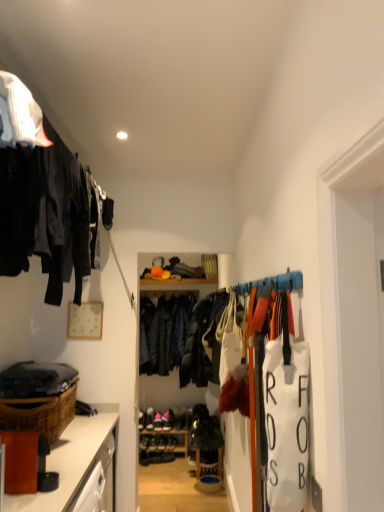
The width and height of the screenshot is (384, 512). I want to click on matte black clothing at upper left, so click(x=45, y=197).

This screenshot has width=384, height=512. I want to click on dark blue leather jacket at center, so click(164, 332).

Image resolution: width=384 pixels, height=512 pixels. What do you see at coordinates (163, 443) in the screenshot? I see `wooden shelf at center` at bounding box center [163, 443].

Find the location of a particular element. Image resolution: width=384 pixels, height=512 pixels. matte black clothing at upper left is located at coordinates (45, 197).

Considering the sizes of objects brown wood cabinet at lower left and matte black clothing at upper left in the image provided, who is taller, brown wood cabinet at lower left or matte black clothing at upper left?

With more height is matte black clothing at upper left.

Is brown wood cabinet at lower left at the right side of matte black clothing at upper left?

No.

Considering the relative sizes of brown wood cabinet at lower left and matte black clothing at upper left in the image provided, is brown wood cabinet at lower left thinner than matte black clothing at upper left?

Incorrect, the width of brown wood cabinet at lower left is not less than that of matte black clothing at upper left.

From the picture: Considering the relative sizes of brown wood cabinet at lower left and dark blue leather jacket at center in the image provided, is brown wood cabinet at lower left bigger than dark blue leather jacket at center?

Yes.

Which of these two, brown wood cabinet at lower left or dark blue leather jacket at center, is wider?

brown wood cabinet at lower left is wider.

Is brown wood cabinet at lower left situated inside dark blue leather jacket at center or outside?

The correct answer is: outside.

From the picture: Who is shorter, brown wood cabinet at lower left or dark blue leather jacket at center?

With less height is brown wood cabinet at lower left.

Considering the sizes of brown woven basket at lower left and dark blue leather jacket at center in the image, is brown woven basket at lower left wider or thinner than dark blue leather jacket at center?

In the image, brown woven basket at lower left appears to be wider than dark blue leather jacket at center.

Considering the sizes of objects brown woven basket at lower left and dark blue leather jacket at center in the image provided, who is shorter, brown woven basket at lower left or dark blue leather jacket at center?

Standing shorter between the two is brown woven basket at lower left.

Is brown woven basket at lower left completely or partially outside of dark blue leather jacket at center?

Yes.

Is brown woven basket at lower left facing towards dark blue leather jacket at center?

No, brown woven basket at lower left is not aimed at dark blue leather jacket at center.

Considering the sizes of objects brown woven basket at lower left and brown wood cabinet at lower left in the image provided, who is bigger, brown woven basket at lower left or brown wood cabinet at lower left?

brown wood cabinet at lower left is bigger.

Is brown woven basket at lower left not close to brown wood cabinet at lower left?

They are positioned close to each other.

Does brown woven basket at lower left have a lesser height compared to brown wood cabinet at lower left?

Indeed, brown woven basket at lower left has a lesser height compared to brown wood cabinet at lower left.

Considering the positions of objects brown woven basket at lower left and brown wood cabinet at lower left in the image provided, who is more to the right, brown woven basket at lower left or brown wood cabinet at lower left?

brown wood cabinet at lower left.

Is pink suede shoes at center situated inside wooden shelf at center or outside?

pink suede shoes at center exists outside the volume of wooden shelf at center.

From the image's perspective, relative to wooden shelf at center, is pink suede shoes at center above or below?

Based on their image positions, pink suede shoes at center is located above wooden shelf at center.

Is pink suede shoes at center beside wooden shelf at center?

No, pink suede shoes at center is not in contact with wooden shelf at center.

Can you tell me how much pink suede shoes at center and wooden shelf at center differ in facing direction?

The angle between the facing direction of pink suede shoes at center and the facing direction of wooden shelf at center is 5.42 degrees.

Considering the points (172, 328) and (56, 219), which point is behind, point (172, 328) or point (56, 219)?

The point (172, 328) is farther.

Is dark blue leather jacket at center in contact with matte black clothing at upper left?

No, dark blue leather jacket at center is not beside matte black clothing at upper left.

From the image's perspective, is dark blue leather jacket at center over matte black clothing at upper left?

No, from the image's perspective, dark blue leather jacket at center is not above matte black clothing at upper left.

The width and height of the screenshot is (384, 512). In order to click on clothing below the matte black clothing at upper left (from a real-world perspective) in this screenshot , I will do `click(164, 332)`.

In terms of width, does brown wood cabinet at lower left look wider or thinner when compared to brown woven basket at lower left?

Clearly, brown wood cabinet at lower left has more width compared to brown woven basket at lower left.

How many degrees apart are the facing directions of brown wood cabinet at lower left and brown woven basket at lower left?

The facing directions of brown wood cabinet at lower left and brown woven basket at lower left are 1.35 degrees apart.

Between brown wood cabinet at lower left and brown woven basket at lower left, which one has smaller size?

Smaller between the two is brown woven basket at lower left.

Where is `closet lying on the right of brown wood cabinet at lower left`? closet lying on the right of brown wood cabinet at lower left is located at coordinates (45, 197).

You are a GUI agent. You are given a task and a screenshot of the screen. Output one action in this format:
    pyautogui.click(x=<x>, y=<y>)
    Task: Click on the cabinetry located underneath the dark blue leather jacket at center (from a real-world perspective)
    The image size is (384, 512).
    Given the screenshot: What is the action you would take?
    pyautogui.click(x=69, y=460)

Estimate the real-world distances between objects in this image. Which object is further from dark blue leather jacket at center, brown woven basket at lower left or pink suede shoes at center?

Among the two, brown woven basket at lower left is located further to dark blue leather jacket at center.

From the image, which object appears to be nearer to brown wood cabinet at lower left, brown woven basket at lower left or dark blue leather jacket at center?

brown woven basket at lower left is positioned closer to the anchor brown wood cabinet at lower left.

Looking at the image, which one is located closer to brown wood cabinet at lower left, pink suede shoes at center or wooden shelf at center?

wooden shelf at center is closer to brown wood cabinet at lower left.

When comparing their distances from wooden shelf at center, does dark blue leather jacket at center or pink suede shoes at center seem further?

dark blue leather jacket at center lies further to wooden shelf at center than the other object.

Based on the photo, looking at the image, which one is located further to matte black clothing at upper left, brown woven basket at lower left or brown wood cabinet at lower left?

Based on the image, brown wood cabinet at lower left appears to be further to matte black clothing at upper left.

Estimate the real-world distances between objects in this image. Which object is closer to dark blue leather jacket at center, brown woven basket at lower left or wooden shelf at center?

wooden shelf at center is positioned closer to the anchor dark blue leather jacket at center.

Which object lies further to the anchor point brown wood cabinet at lower left, brown woven basket at lower left or pink suede shoes at center?

Based on the image, pink suede shoes at center appears to be further to brown wood cabinet at lower left.

Considering their positions, is wooden shelf at center positioned closer to matte black clothing at upper left than pink suede shoes at center?

wooden shelf at center.

Image resolution: width=384 pixels, height=512 pixels. I want to click on cabinetry between matte black clothing at upper left and wooden shelf at center from front to back, so click(69, 460).

Find the location of a particular element. basket between matte black clothing at upper left and dark blue leather jacket at center in the front-back direction is located at coordinates (40, 413).

Where is `basket between brown wood cabinet at lower left and wooden shelf at center along the z-axis`? This screenshot has height=512, width=384. basket between brown wood cabinet at lower left and wooden shelf at center along the z-axis is located at coordinates (40, 413).

Locate an element on the screen. This screenshot has width=384, height=512. shelf positioned between brown woven basket at lower left and pink suede shoes at center from near to far is located at coordinates pyautogui.click(x=163, y=443).